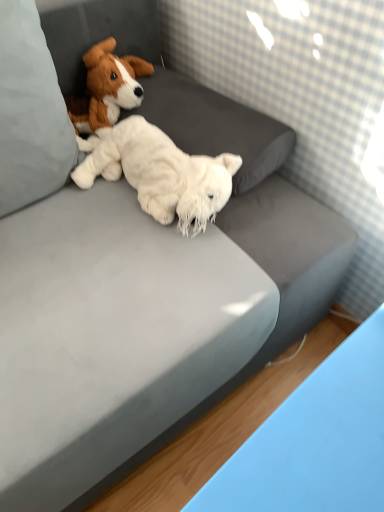
Question: From the image's perspective, does brown plush dog at upper left, acting as the first dog starting from the top, appear higher than white soft pillow at upper left?

Choices:
 (A) yes
 (B) no

Answer: (A)

Question: Is brown plush dog at upper left, placed as the 2th dog when sorted from bottom to top, outside of white soft pillow at upper left?

Choices:
 (A) yes
 (B) no

Answer: (A)

Question: Is brown plush dog at upper left, acting as the first dog starting from the top, oriented towards white soft pillow at upper left?

Choices:
 (A) yes
 (B) no

Answer: (B)

Question: Is brown plush dog at upper left, placed as the 2th dog when sorted from bottom to top, turned away from white soft pillow at upper left?

Choices:
 (A) no
 (B) yes

Answer: (A)

Question: Is brown plush dog at upper left, acting as the first dog starting from the top, shorter than white soft pillow at upper left?

Choices:
 (A) no
 (B) yes

Answer: (B)

Question: In terms of height, does white soft pillow at upper left look taller or shorter compared to brown plush dog at upper left, acting as the first dog starting from the top?

Choices:
 (A) short
 (B) tall

Answer: (B)

Question: Is point (9, 47) positioned closer to the camera than point (102, 45)?

Choices:
 (A) closer
 (B) farther

Answer: (A)

Question: In terms of width, does white soft pillow at upper left look wider or thinner when compared to brown plush dog at upper left, acting as the first dog starting from the top?

Choices:
 (A) thin
 (B) wide

Answer: (B)

Question: From a real-world perspective, is white soft pillow at upper left positioned above or below brown plush dog at upper left, placed as the 2th dog when sorted from bottom to top?

Choices:
 (A) above
 (B) below

Answer: (A)

Question: From a real-world perspective, is brown plush dog at upper left, placed as the 2th dog when sorted from bottom to top, positioned above or below white fluffy stuffed animal at center, which ranks as the 1th dog in bottom-to-top order?

Choices:
 (A) above
 (B) below

Answer: (A)

Question: From the image's perspective, is brown plush dog at upper left, acting as the first dog starting from the top, located above or below white fluffy stuffed animal at center, which ranks as the 1th dog in bottom-to-top order?

Choices:
 (A) below
 (B) above

Answer: (B)

Question: Considering the relative positions of brown plush dog at upper left, acting as the first dog starting from the top, and white fluffy stuffed animal at center, the second dog when ordered from top to bottom, in the image provided, is brown plush dog at upper left, acting as the first dog starting from the top, to the left or to the right of white fluffy stuffed animal at center, the second dog when ordered from top to bottom,?

Choices:
 (A) left
 (B) right

Answer: (A)

Question: Does point (109, 76) appear closer or farther from the camera than point (221, 181)?

Choices:
 (A) closer
 (B) farther

Answer: (B)

Question: From a real-world perspective, is white soft pillow at upper left above or below white fluffy stuffed animal at center, which ranks as the 1th dog in bottom-to-top order?

Choices:
 (A) above
 (B) below

Answer: (A)

Question: Is white soft pillow at upper left bigger or smaller than white fluffy stuffed animal at center, which ranks as the 1th dog in bottom-to-top order?

Choices:
 (A) small
 (B) big

Answer: (B)